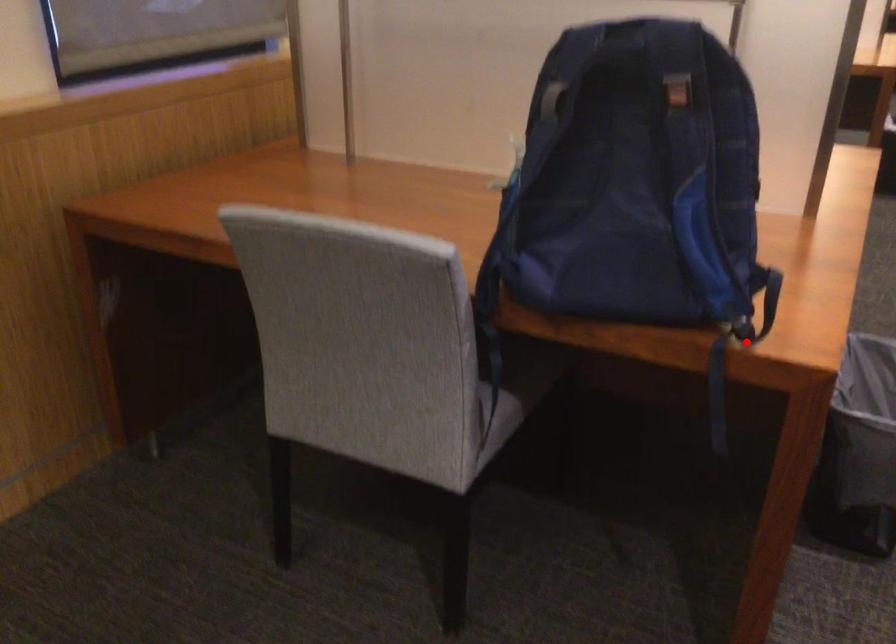
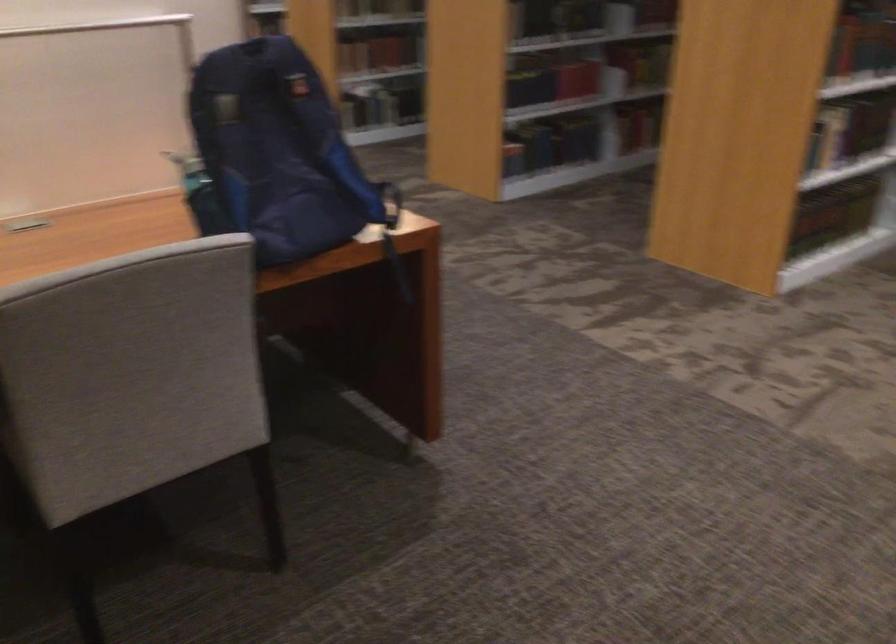
Locate, in the second image, the point that corresponds to the highlighted location in the first image.

(392, 234)